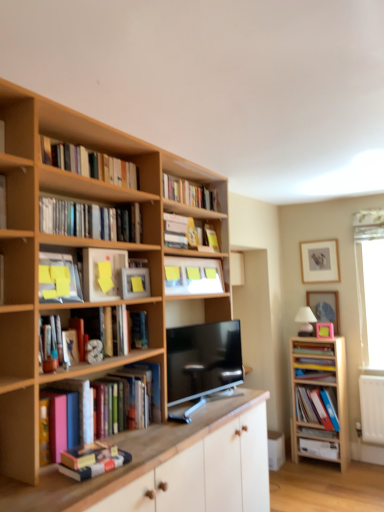
Where is `free spot above wooden bookshelf at upper left, placed as the eleventh book when sorted from bottom to top (from a real-world perspective)`? The height and width of the screenshot is (512, 384). free spot above wooden bookshelf at upper left, placed as the eleventh book when sorted from bottom to top (from a real-world perspective) is located at coordinates (89, 142).